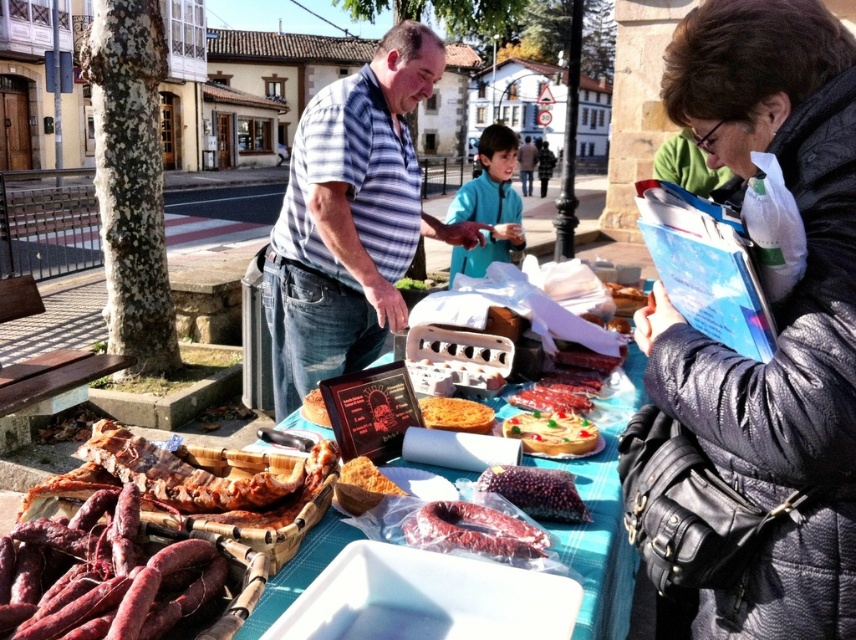
You are a customer at the market and want to pick up an item from the table. You notice two points on the table surface. Which point is closer to you, point (195, 548) or point (536, 536)?

Point (195, 548) is closer to the viewer than point (536, 536).

You are a customer at the market and want to buy both the leather jacket at lower right and the shiny red sausages at center. The vendor has a rule that if one item is wider than the other, you must place the wider item on the left side of the scale to ensure balance. Which item should you place on the left side of the scale?

The leather jacket at lower right is wider than the shiny red sausages at center, so you should place the leather jacket at lower right on the left side of the scale to follow the vendor rule.